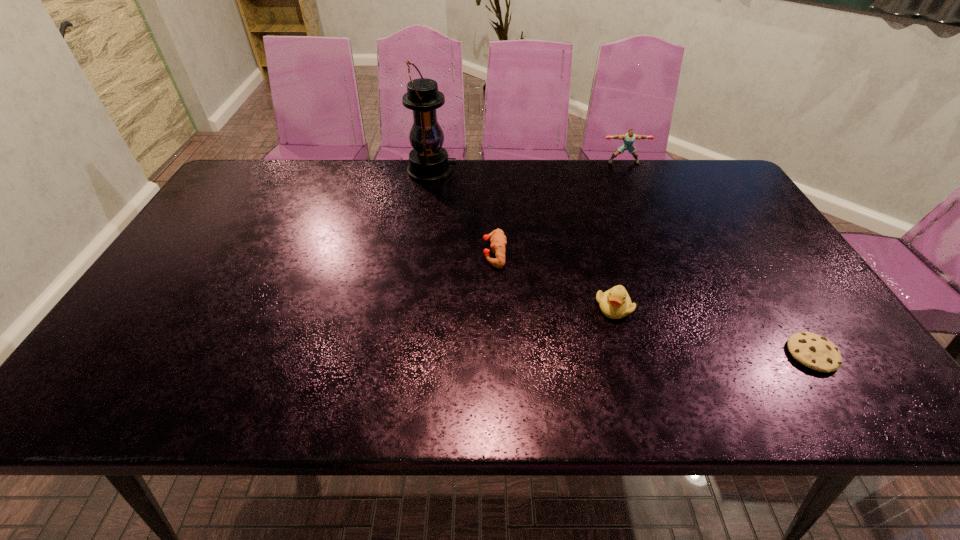
The image size is (960, 540). Find the location of `free area in between the taller puncher and the duckling`. free area in between the taller puncher and the duckling is located at coordinates (618, 235).

Where is `empty location between the nearest object and the fourth object from left to right`? This screenshot has height=540, width=960. empty location between the nearest object and the fourth object from left to right is located at coordinates (718, 258).

You are a GUI agent. You are given a task and a screenshot of the screen. Output one action in this format:
    pyautogui.click(x=<x>, y=<y>)
    Task: Click on the free space that is in between the lantern and the farther puncher
    This screenshot has width=960, height=540.
    Given the screenshot: What is the action you would take?
    pyautogui.click(x=528, y=167)

Find the location of `free spot between the taller puncher and the lantern`. free spot between the taller puncher and the lantern is located at coordinates (528, 167).

I want to click on free space between the shorter puncher and the fourth farthest object, so click(554, 280).

What are the coordinates of `free area in between the third tallest object and the cookie` in the screenshot? It's located at (713, 331).

This screenshot has height=540, width=960. What are the coordinates of `free area in between the second object from left to right and the third shortest object` in the screenshot? It's located at (554, 280).

Where is `free space between the rightmost object and the duckling`? Image resolution: width=960 pixels, height=540 pixels. free space between the rightmost object and the duckling is located at coordinates tap(713, 331).

Locate which object ranks third in proximity to the leftmost object. Please provide its 2D coordinates. Your answer should be formatted as a tuple, i.e. [(x, y)], where the tuple contains the x and y coordinates of a point satisfying the conditions above.

[(615, 303)]

Select which object is the second closest to the third farthest object. Please provide its 2D coordinates. Your answer should be formatted as a tuple, i.e. [(x, y)], where the tuple contains the x and y coordinates of a point satisfying the conditions above.

[(428, 161)]